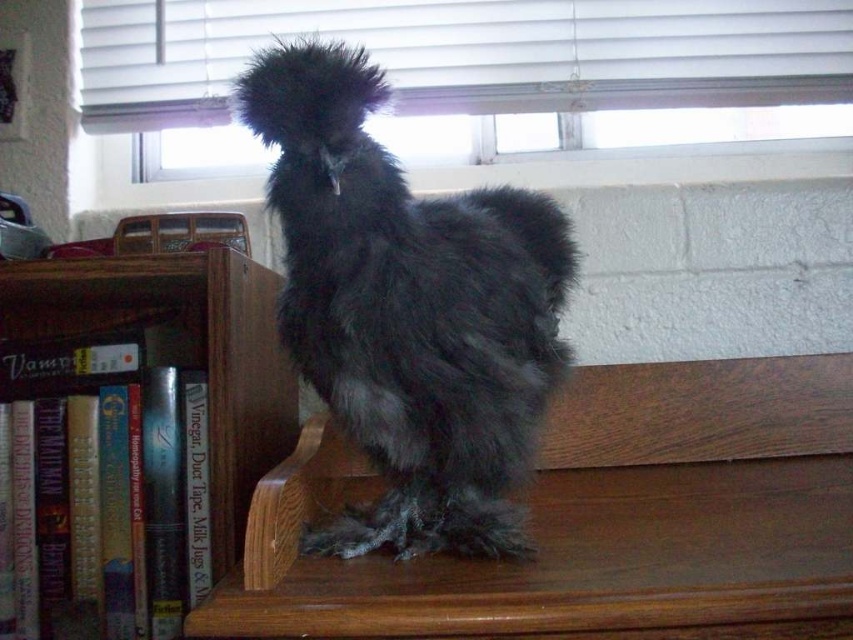
Question: Based on their relative distances, which object is nearer to the silvery-gray fluffy cock at center?

Choices:
 (A) wooden bookcase at left
 (B) brown wood shelf at center

Answer: (B)

Question: Does silvery-gray fluffy cock at center appear on the right side of wooden bookcase at left?

Choices:
 (A) no
 (B) yes

Answer: (B)

Question: Estimate the real-world distances between objects in this image. Which object is closer to the wooden bookcase at left?

Choices:
 (A) silvery-gray fluffy cock at center
 (B) brown wood shelf at center

Answer: (A)

Question: Can you confirm if silvery-gray fluffy cock at center is wider than wooden bookcase at left?

Choices:
 (A) no
 (B) yes

Answer: (A)

Question: Which object appears closest to the camera in this image?

Choices:
 (A) brown wood shelf at center
 (B) wooden bookcase at left

Answer: (A)

Question: Is brown wood shelf at center thinner than silvery-gray fluffy cock at center?

Choices:
 (A) yes
 (B) no

Answer: (B)